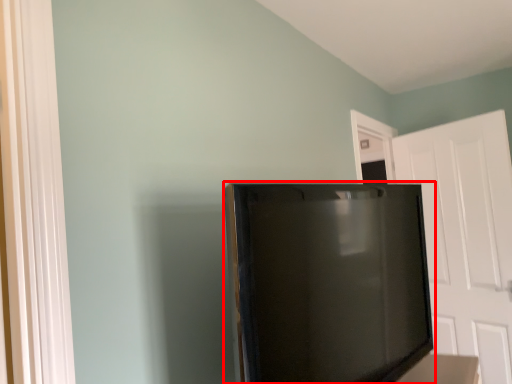
Question: From the image's perspective, considering the relative positions of refrigerator (annotated by the red box) and door in the image provided, where is refrigerator (annotated by the red box) located with respect to the staircase?

Choices:
 (A) below
 (B) above

Answer: (B)